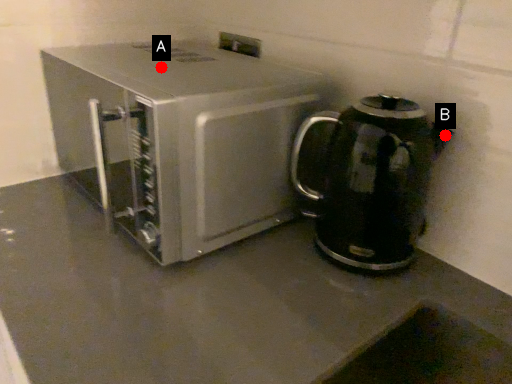
Question: Two points are circled on the image, labeled by A and B beside each circle. Among these points, which one is farthest from the camera?

Choices:
 (A) A is further
 (B) B is further

Answer: (A)